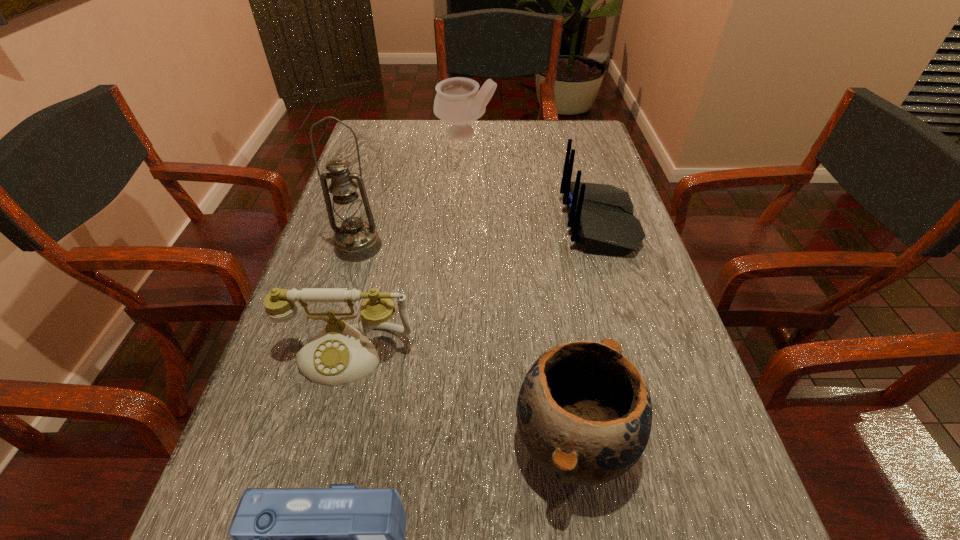
Identify which object is the fifth nearest to the tallest object. Please provide its 2D coordinates. Your answer should be formatted as a tuple, i.e. [(x, y)], where the tuple contains the x and y coordinates of a point satisfying the conditions above.

[(344, 539)]